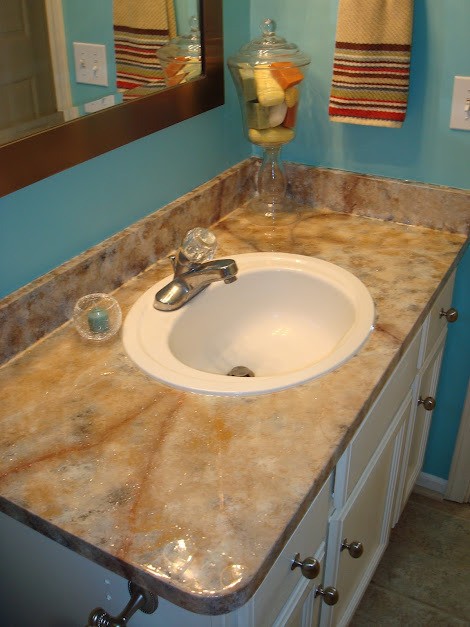
You are a GUI agent. You are given a task and a screenshot of the screen. Output one action in this format:
    pyautogui.click(x=<x>, y=<y>)
    Task: Click on the soaps
    Image resolution: width=470 pixels, height=627 pixels.
    Given the screenshot: What is the action you would take?
    pyautogui.click(x=268, y=92)